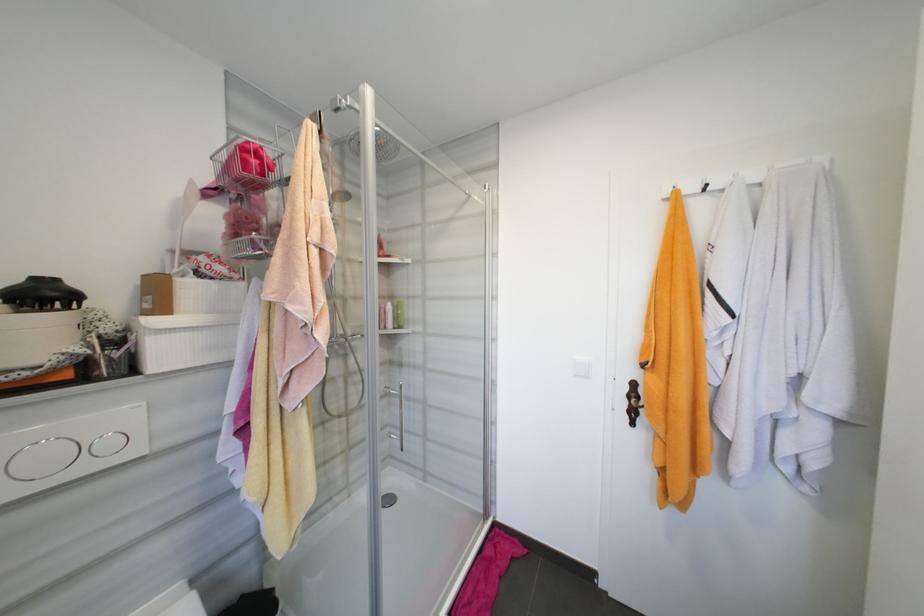
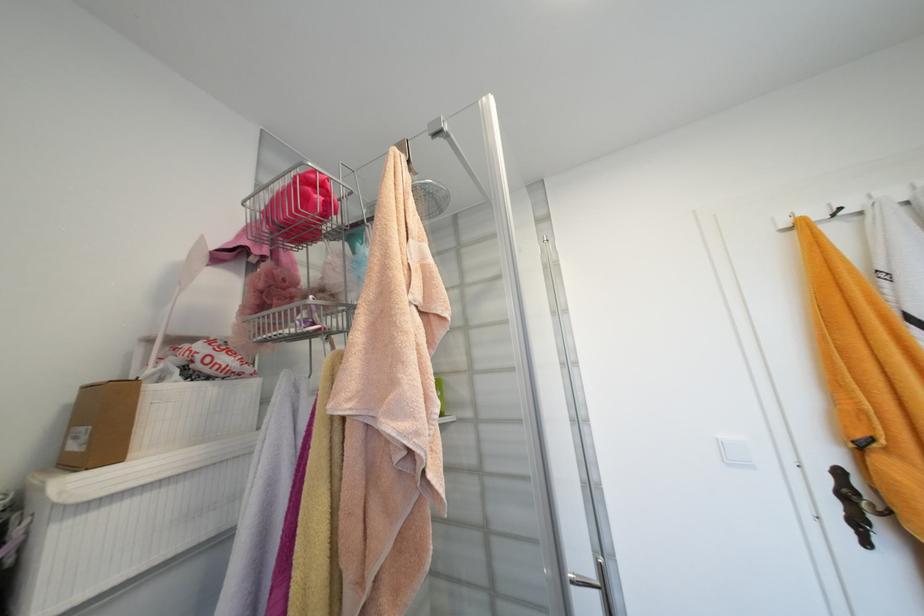
The point at (224, 282) is marked in the first image. Where is the corresponding point in the second image?

(224, 383)